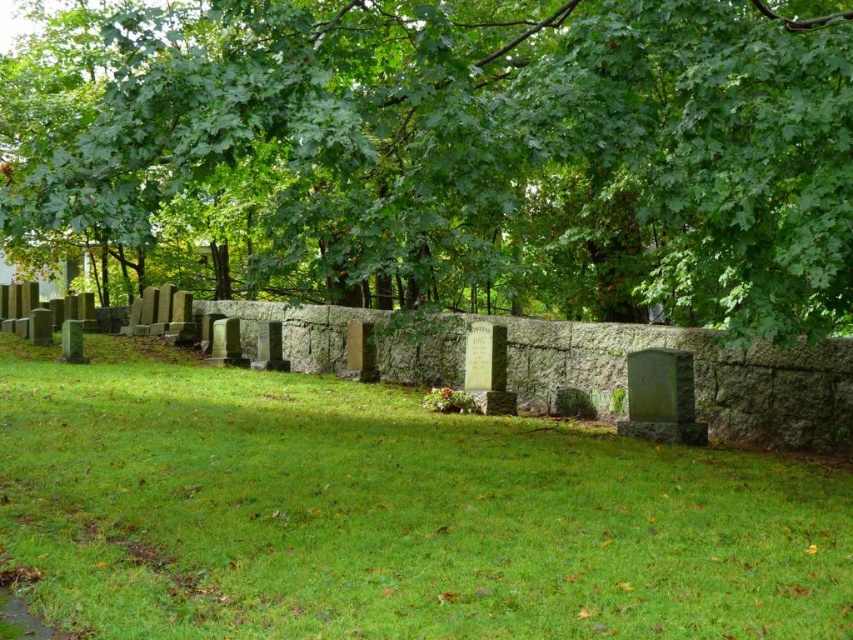
Question: Is green leafy tree at upper center thinner than green grassy at center?

Choices:
 (A) no
 (B) yes

Answer: (A)

Question: Which point appears closest to the camera in this image?

Choices:
 (A) (759, 124)
 (B) (581, 564)

Answer: (B)

Question: Is green leafy tree at upper center wider than green grassy at center?

Choices:
 (A) yes
 (B) no

Answer: (A)

Question: Is green leafy tree at upper center in front of green grassy at center?

Choices:
 (A) yes
 (B) no

Answer: (B)